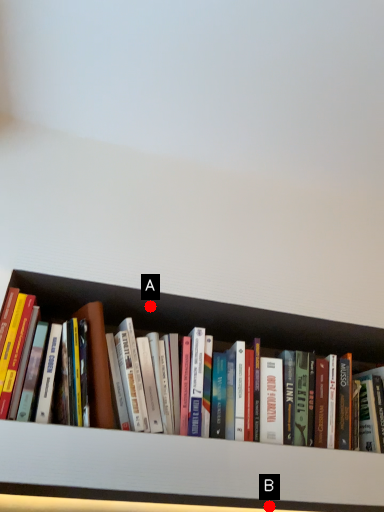
Question: Two points are circled on the image, labeled by A and B beside each circle. Which point appears closest to the camera in this image?

Choices:
 (A) A is closer
 (B) B is closer

Answer: (B)